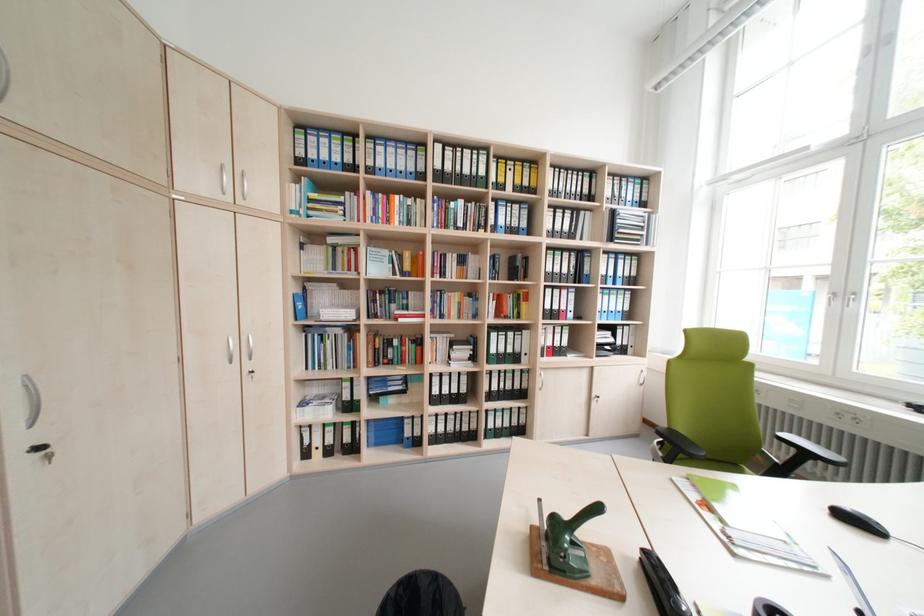
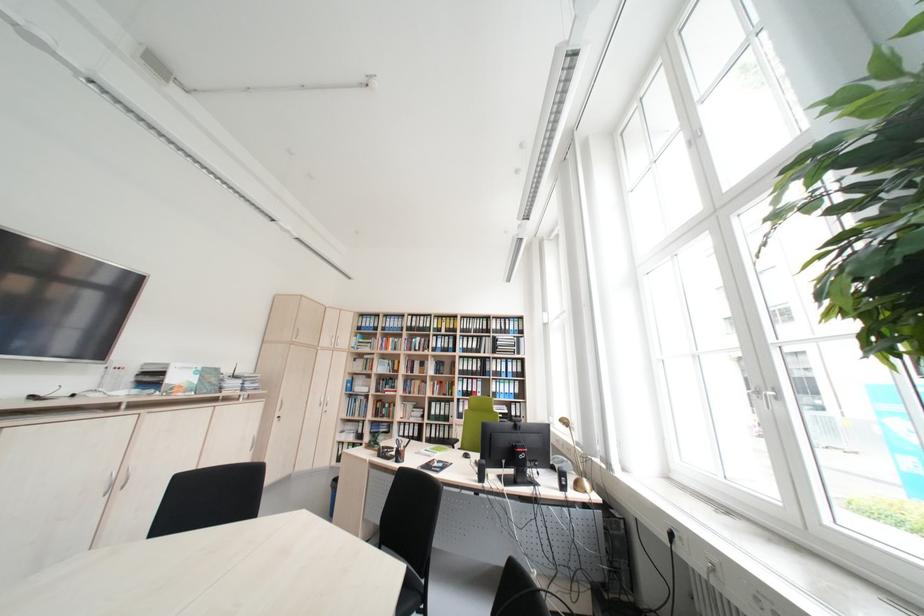
In a continuous first-person perspective shot, in which direction is the camera moving?

The cameraman moved toward right, backward.